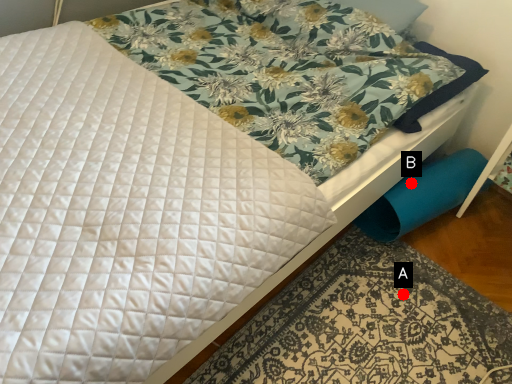
Question: Two points are circled on the image, labeled by A and B beside each circle. Which point is farther to the camera?

Choices:
 (A) A is further
 (B) B is further

Answer: (B)